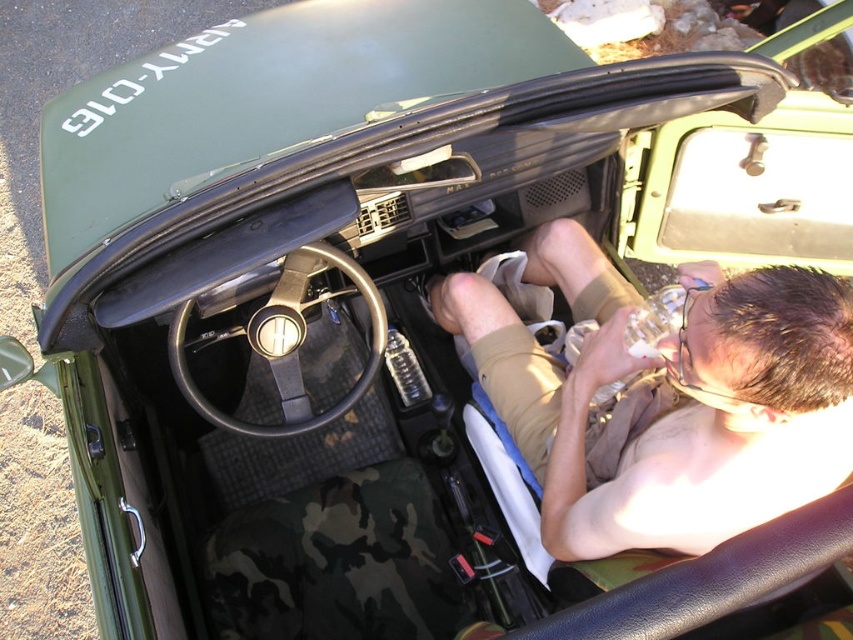
Question: Which object appears closest to the camera in this image?

Choices:
 (A) tan fabric leg at center
 (B) black rubber steering wheel at center

Answer: (A)

Question: Can you confirm if tan fabric leg at center is positioned below black rubber steering wheel at center?

Choices:
 (A) yes
 (B) no

Answer: (A)

Question: Is tan fabric leg at center wider than black rubber steering wheel at center?

Choices:
 (A) yes
 (B) no

Answer: (A)

Question: Is tan fabric leg at center to the left of black rubber steering wheel at center from the viewer's perspective?

Choices:
 (A) no
 (B) yes

Answer: (A)

Question: Which object appears farthest from the camera in this image?

Choices:
 (A) tan fabric leg at center
 (B) black rubber steering wheel at center

Answer: (B)